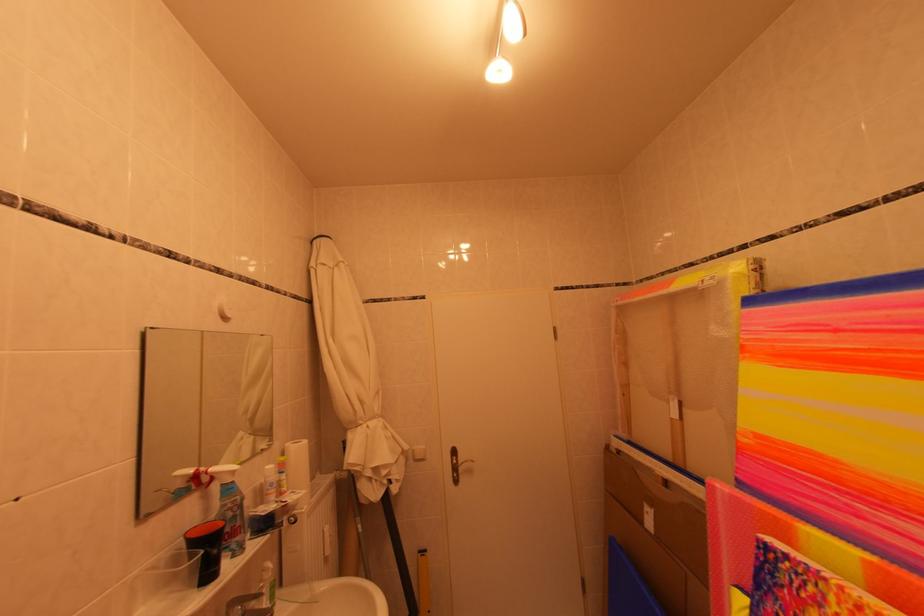
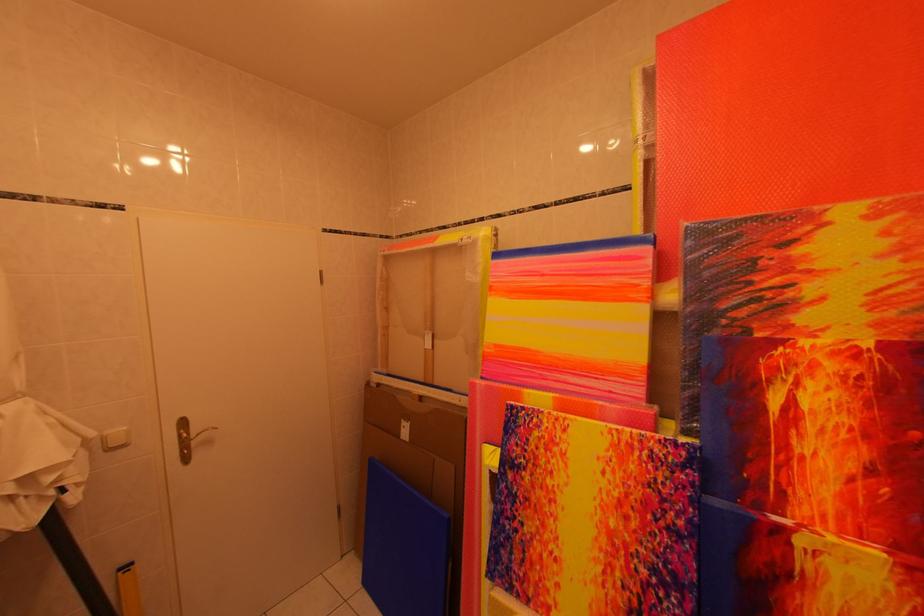
Question: The images are taken continuously from a first-person perspective. In which direction is your viewpoint rotating?

Choices:
 (A) Left
 (B) Right
 (C) Up
 (D) Down

Answer: (B)